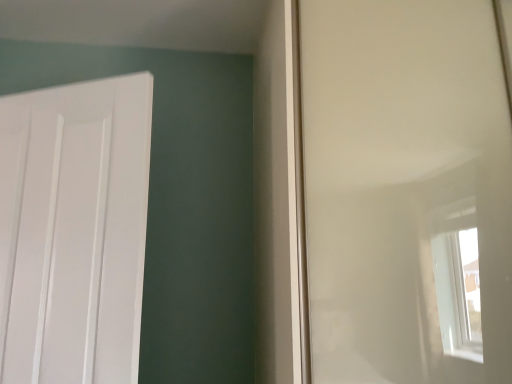
Question: Should I look upward or downward to see transparent plastic window screen at right?

Choices:
 (A) up
 (B) down

Answer: (A)

Question: Can you confirm if white matte door at left is wider than transparent plastic window screen at right?

Choices:
 (A) yes
 (B) no

Answer: (B)

Question: Is white matte door at left oriented towards transparent plastic window screen at right?

Choices:
 (A) no
 (B) yes

Answer: (A)

Question: Considering the relative sizes of white matte door at left and transparent plastic window screen at right in the image provided, is white matte door at left bigger than transparent plastic window screen at right?

Choices:
 (A) no
 (B) yes

Answer: (A)

Question: Is white matte door at left looking in the opposite direction of transparent plastic window screen at right?

Choices:
 (A) yes
 (B) no

Answer: (B)

Question: Are white matte door at left and transparent plastic window screen at right far apart?

Choices:
 (A) yes
 (B) no

Answer: (B)

Question: Considering the relative positions of white matte door at left and transparent plastic window screen at right in the image provided, is white matte door at left to the right of transparent plastic window screen at right from the viewer's perspective?

Choices:
 (A) no
 (B) yes

Answer: (A)

Question: Is transparent plastic window screen at right oriented away from white matte door at left?

Choices:
 (A) no
 (B) yes

Answer: (A)

Question: From a real-world perspective, is transparent plastic window screen at right positioned over white matte door at left based on gravity?

Choices:
 (A) yes
 (B) no

Answer: (A)

Question: Considering the relative sizes of transparent plastic window screen at right and white matte door at left in the image provided, is transparent plastic window screen at right thinner than white matte door at left?

Choices:
 (A) no
 (B) yes

Answer: (A)

Question: Is transparent plastic window screen at right not within white matte door at left?

Choices:
 (A) no
 (B) yes

Answer: (B)

Question: Considering the relative sizes of transparent plastic window screen at right and white matte door at left in the image provided, is transparent plastic window screen at right bigger than white matte door at left?

Choices:
 (A) no
 (B) yes

Answer: (B)

Question: Is transparent plastic window screen at right wider than white matte door at left?

Choices:
 (A) no
 (B) yes

Answer: (B)

Question: From a real-world perspective, is white matte door at left physically located above or below transparent plastic window screen at right?

Choices:
 (A) above
 (B) below

Answer: (B)